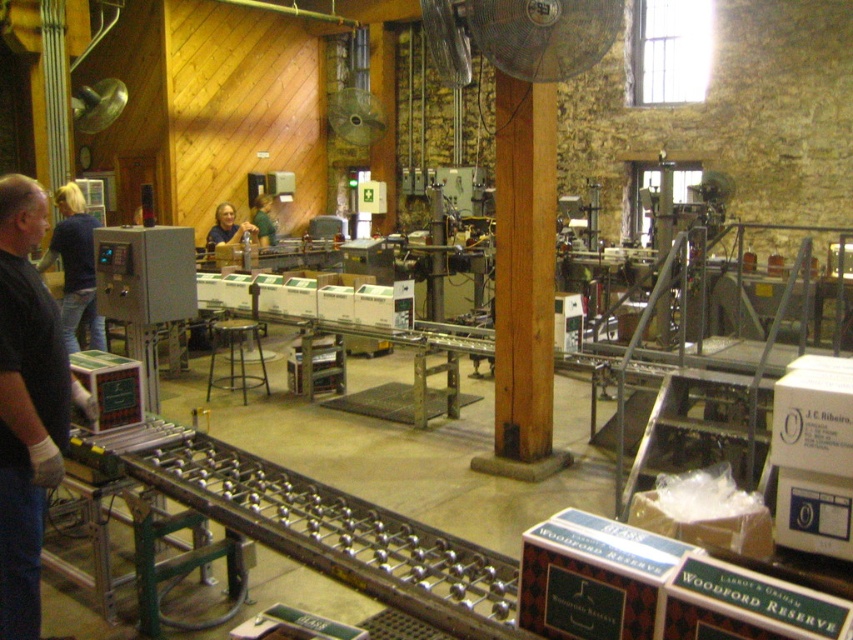
What is located at the coordinates point (228, 227)?

The location at point (228, 227) has a matte blue shirt at center.

You are an inspector in the warehouse and need to check the control panel. You see the black fabric shirt at left and the matte blue shirt at center. Which shirt is closer to the control panel?

The black fabric shirt at left is closer to the control panel because it is in front of the matte blue shirt at center.